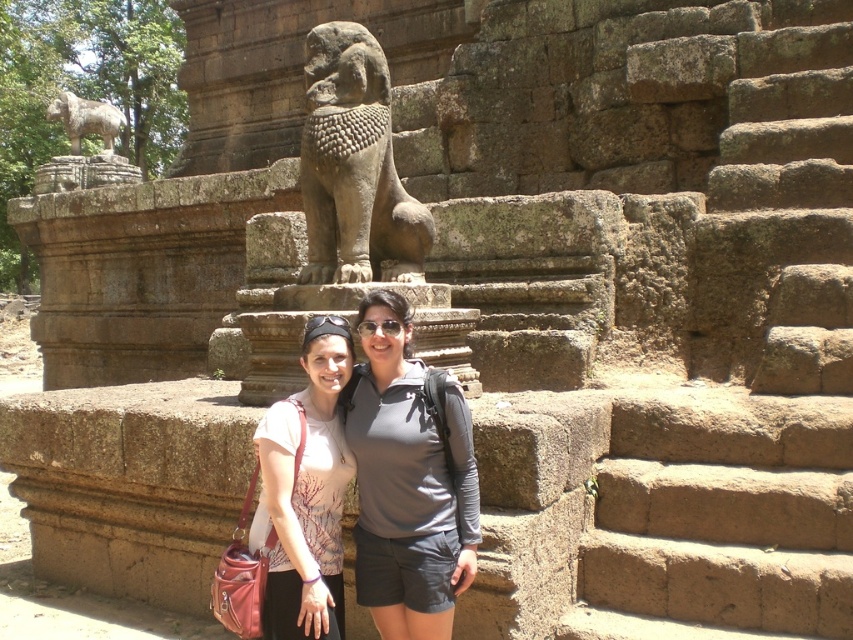
You are a photographer trying to capture both the gray matte shirt at center and the matte white blouse at center in a single shot. Based on their positions, which one is closer to the camera?

The gray matte shirt at center is positioned under the matte white blouse at center, so the gray matte shirt at center is closer to the camera since it is below the other object.

You are a photographer planning to take a picture of the gray stone lion at center and the gray stone lion at upper left. Which lion should you focus on first if you want to capture both in the frame without moving the camera?

You should focus on the gray stone lion at upper left first because it is taller than the gray stone lion at center, so it will occupy more space in the frame and ensure proper composition.